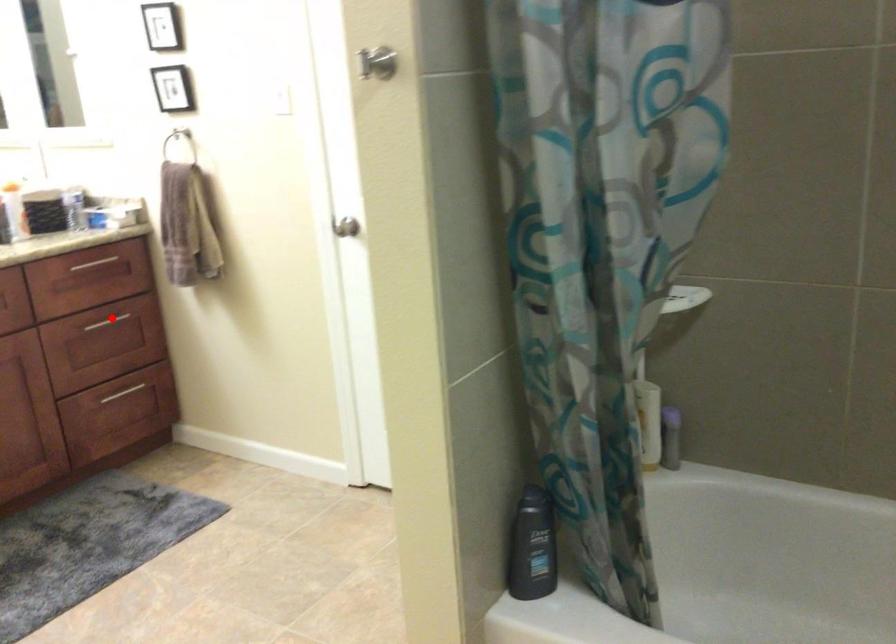
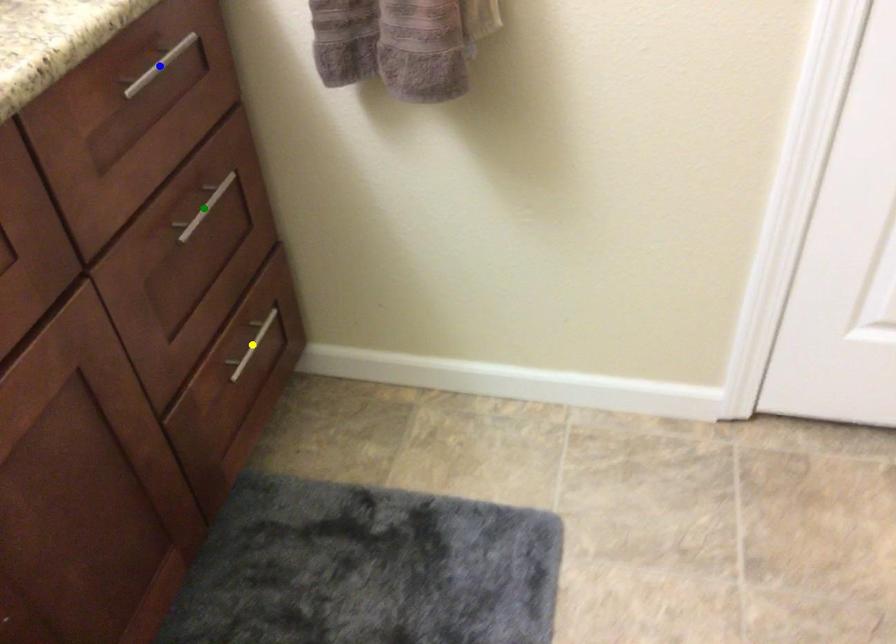
Question: I am providing you with two images of the same scene from different viewpoints. A red point is marked on the first image. You are given multiple points on the second image. Can you choose the point in image 2 that corresponds to the point in image 1?

Choices:
 (A) blue point
 (B) yellow point
 (C) green point

Answer: (C)